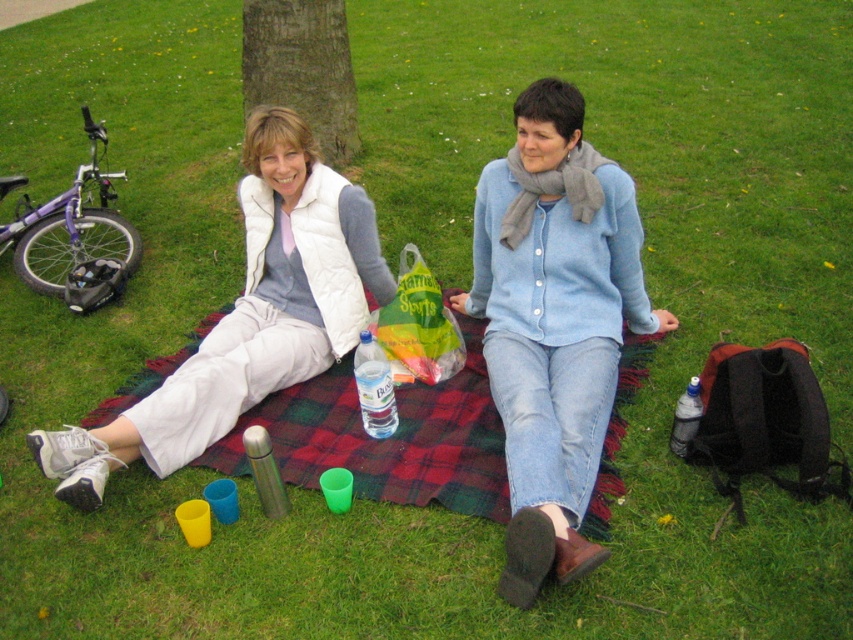
Looking at this image, you are planning to place a new item on the picnic blanket. The coordinates of the clear plastic bottle at center are given as point A. If you want to place a new item exactly to the left of point A, where should you position it?

To place the new item exactly to the left of the clear plastic bottle at center located at point A, you should position it at a coordinate with the same y value as point A but a lower x value.

Looking at this image, you are planning to take a photo of the picnic scene. The photographer wants to ensure the plaid fabric blanket at center and the brown textured tree at upper center are both visible in the frame. Based on their positions, which object should be placed closer to the bottom of the photo?

The plaid fabric blanket at center should be placed closer to the bottom of the photo because it is located below the brown textured tree at upper center in the scene.

In the scene shown: You are planning to pack for a picnic and need to choose between the clear plastic bottle at center and the translucent plastic bottle at lower right. Based on their sizes, which one can hold more liquid?

The clear plastic bottle at center is much taller than the translucent plastic bottle at lower right, so it can hold more liquid.